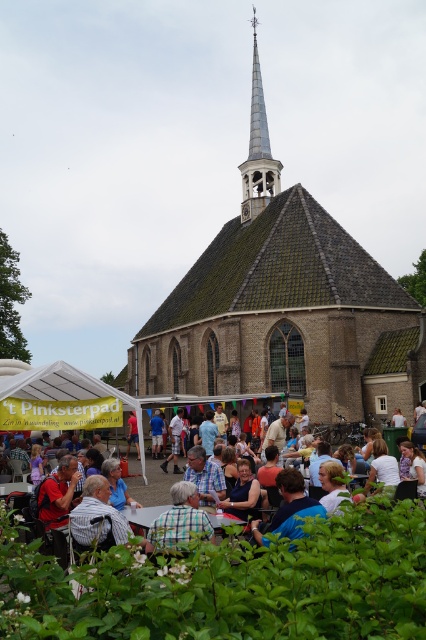
Does point (115, 522) come closer to viewer compared to point (186, 483)?

Yes, it is.

Between gray striped shirt at center and checkered fabric shirt at center, which one has more height?

checkered fabric shirt at center

Is point (95, 499) positioned after point (164, 541)?

Yes, point (95, 499) is behind point (164, 541).

This screenshot has height=640, width=426. Identify the location of gray striped shirt at center. (97, 515).

Who is taller, brown brick church at center or checkered fabric shirt at center?

brown brick church at center is taller.

Consider the image. Is brown brick church at center to the left of checkered fabric shirt at center from the viewer's perspective?

Incorrect, brown brick church at center is not on the left side of checkered fabric shirt at center.

Who is more forward, (314, 221) or (204, 524)?

Point (204, 524)

Identify the location of brown brick church at center. The image size is (426, 640). (284, 307).

Does white fabric canopy at lower left have a smaller size compared to checkered fabric shirt at center?

Actually, white fabric canopy at lower left might be larger than checkered fabric shirt at center.

Can you confirm if white fabric canopy at lower left is shorter than checkered fabric shirt at center?

No, white fabric canopy at lower left is not shorter than checkered fabric shirt at center.

Does point (14, 378) lie behind point (187, 525)?

Yes, it is.

I want to click on white fabric canopy at lower left, so click(x=60, y=385).